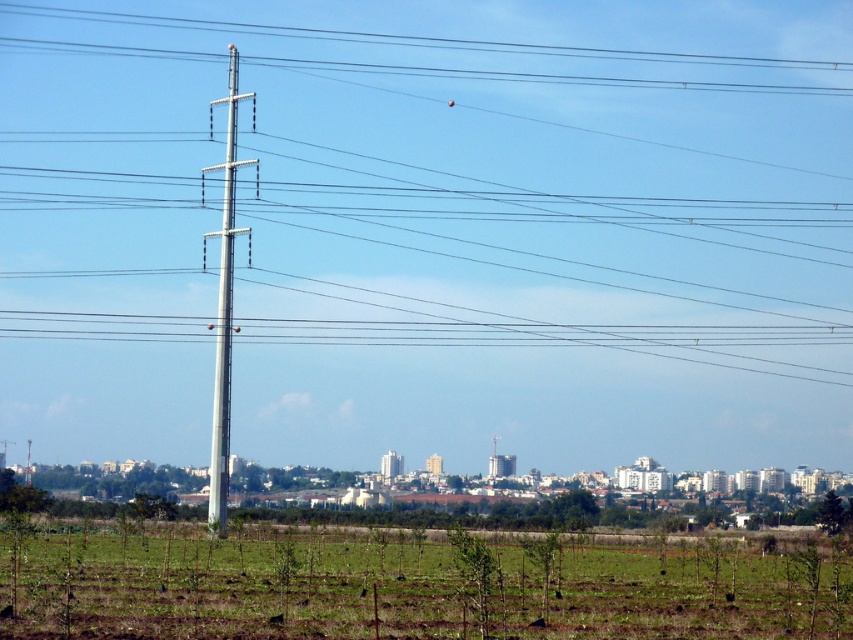
Question: Can you confirm if metallic wire at center is positioned below metallic gray telegraph pole at left?

Choices:
 (A) yes
 (B) no

Answer: (B)

Question: Can you confirm if metallic wire at center is positioned to the right of green grassy field at lower center?

Choices:
 (A) no
 (B) yes

Answer: (A)

Question: Which of these objects is positioned farthest from the metallic gray telegraph pole at left?

Choices:
 (A) green grassy field at lower center
 (B) metallic wire at center

Answer: (B)

Question: Where is metallic wire at center located in relation to green grassy field at lower center in the image?

Choices:
 (A) below
 (B) above

Answer: (B)

Question: Estimate the real-world distances between objects in this image. Which object is farther from the green grassy field at lower center?

Choices:
 (A) metallic wire at center
 (B) metallic gray telegraph pole at left

Answer: (A)

Question: Which object is positioned closest to the metallic gray telegraph pole at left?

Choices:
 (A) green grassy field at lower center
 (B) metallic wire at center

Answer: (A)